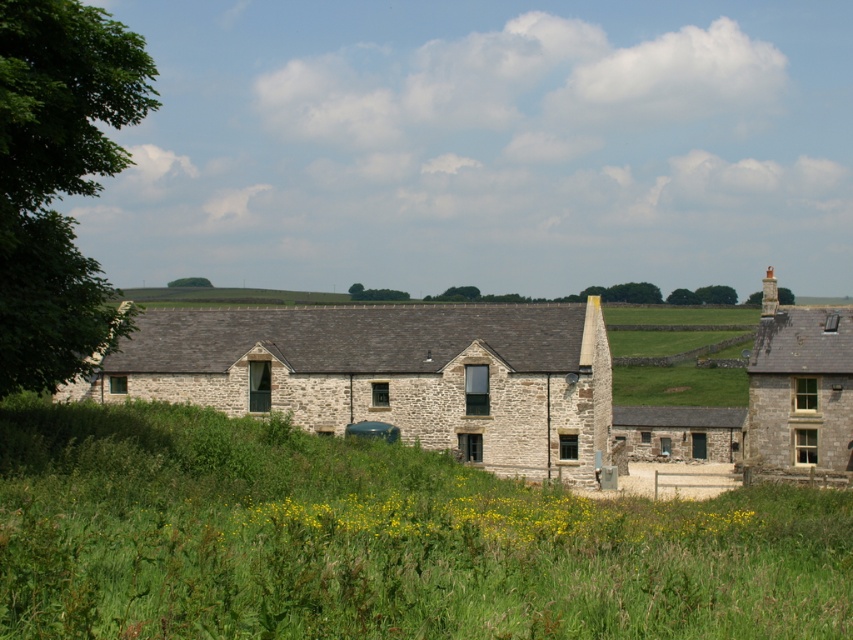
Can you confirm if stone cottage at center is thinner than smooth gray chimney at upper right?

Indeed, stone cottage at center has a lesser width compared to smooth gray chimney at upper right.

Can you confirm if stone cottage at center is positioned to the left of smooth gray chimney at upper right?

Correct, you'll find stone cottage at center to the left of smooth gray chimney at upper right.

Image resolution: width=853 pixels, height=640 pixels. What are the coordinates of `stone cottage at center` in the screenshot? It's located at (389, 374).

At what (x,y) coordinates should I click in order to perform the action: click on stone cottage at center. Please return your answer as a coordinate pair (x, y). Looking at the image, I should click on (389, 374).

Based on the photo, can you confirm if green grassy field at center is thinner than stone cottage at center?

Indeed, green grassy field at center has a lesser width compared to stone cottage at center.

Does green grassy field at center come behind stone cottage at center?

No, it is not.

Identify the location of green grassy field at center. This screenshot has width=853, height=640. click(x=376, y=540).

Is green grassy field at center smaller than stone chimney at upper right?

No, green grassy field at center is not smaller than stone chimney at upper right.

The width and height of the screenshot is (853, 640). What do you see at coordinates (376, 540) in the screenshot? I see `green grassy field at center` at bounding box center [376, 540].

Is point (590, 502) positioned after point (840, 342)?

No, it is not.

The width and height of the screenshot is (853, 640). I want to click on green grassy field at center, so click(x=376, y=540).